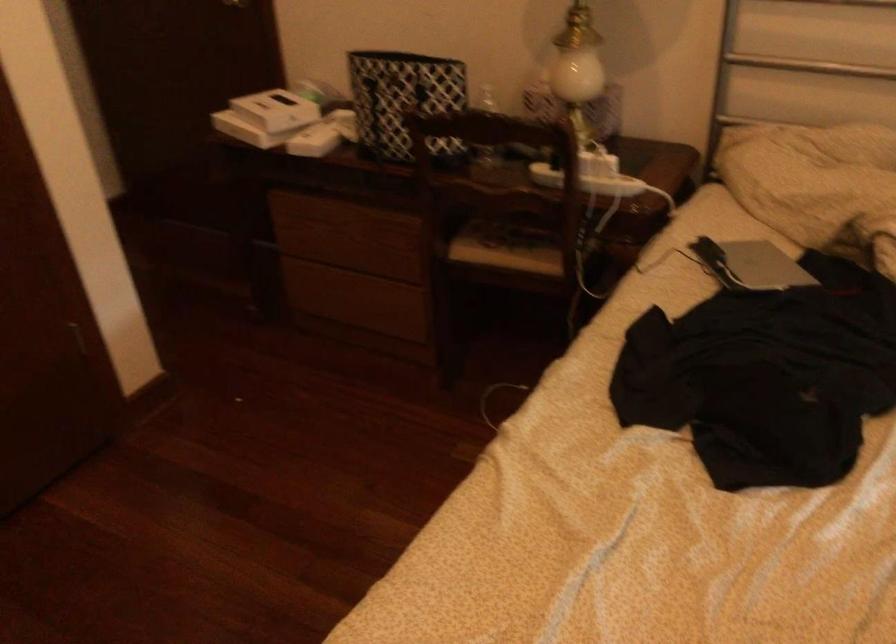
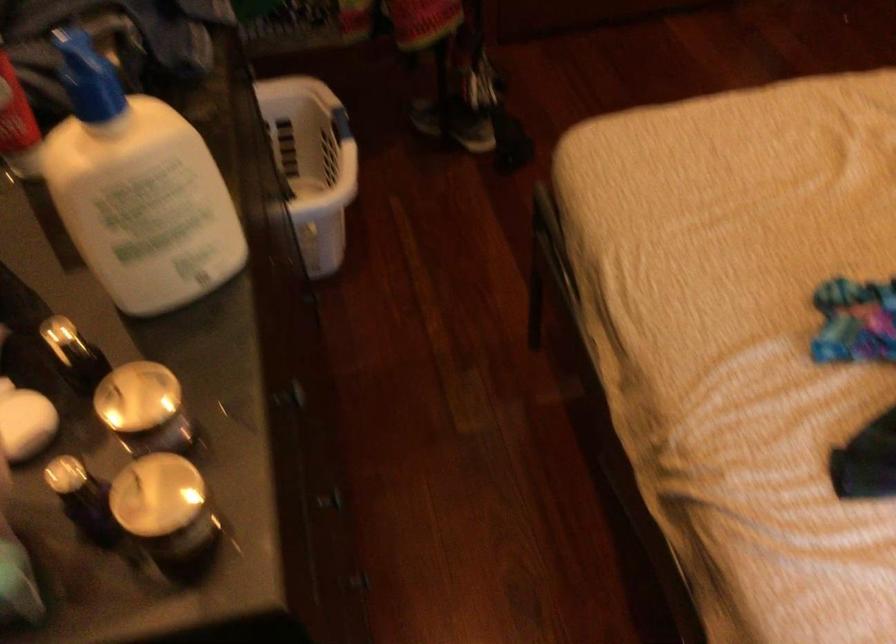
How did the camera likely rotate?

The rotation direction of the camera is left-down.